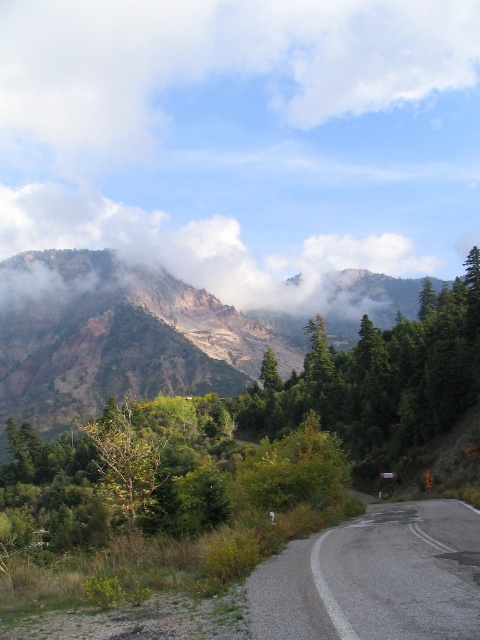
You are a hiker standing at point (98, 429) and want to reach point (248, 323). Given the mountainous terrain, which direction should you move relative to your current position?

You should move northward because point (248, 323) is behind point (98, 429), indicating it is in the northern direction from your current position.

Looking at this image, you are a hiker planning to take a photo of the rustic stone mountain at upper left and the white fluffy cloud at upper center. Based on their sizes in the image, which one should you zoom in on more to capture both clearly?

The white fluffy cloud at upper center might be wider than rustic stone mountain at upper left, so you should zoom in more on the rustic stone mountain at upper left to ensure both fit clearly in the frame.